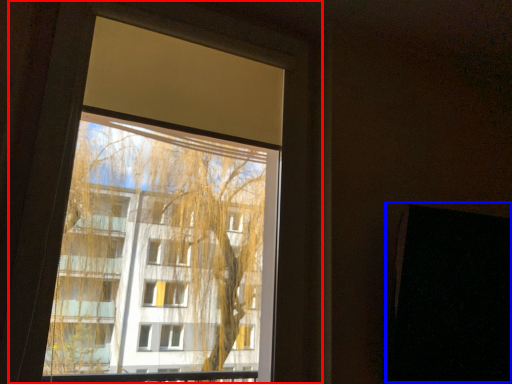
Question: Among these objects, which one is farthest to the camera, window (highlighted by a red box) or screen door (highlighted by a blue box)?

Choices:
 (A) window
 (B) screen door

Answer: (B)